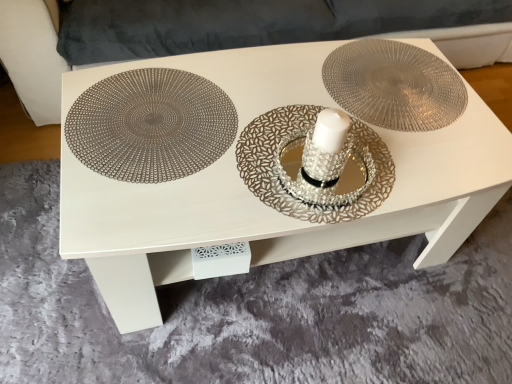
Find the location of a particular element. This screenshot has height=384, width=512. free spot above metallic woven placemat at left (from a real-world perspective) is located at coordinates (162, 118).